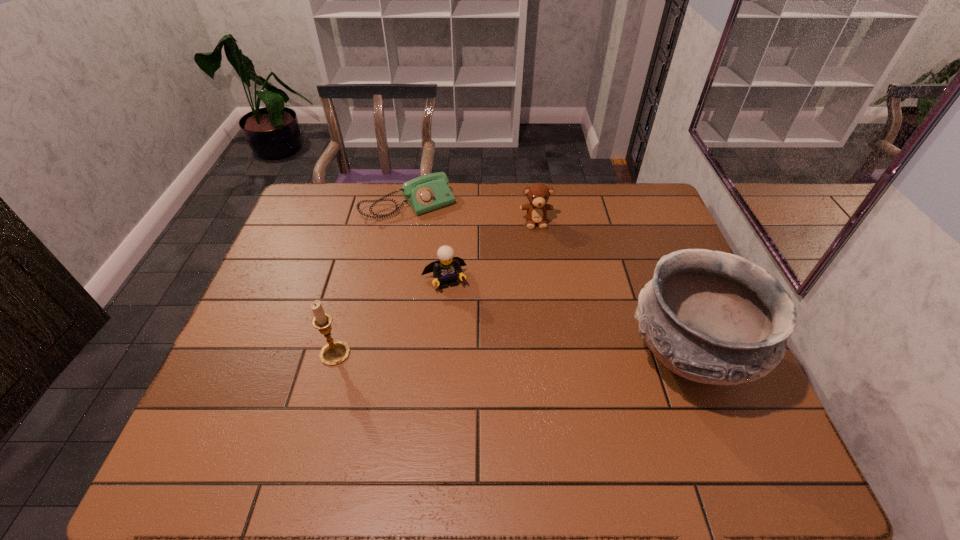
Where is `free space that satisfies the following two spatial constraints: 1. on the front side of the tallest object; 2. on the left side of the telephone`? The width and height of the screenshot is (960, 540). free space that satisfies the following two spatial constraints: 1. on the front side of the tallest object; 2. on the left side of the telephone is located at coordinates (380, 356).